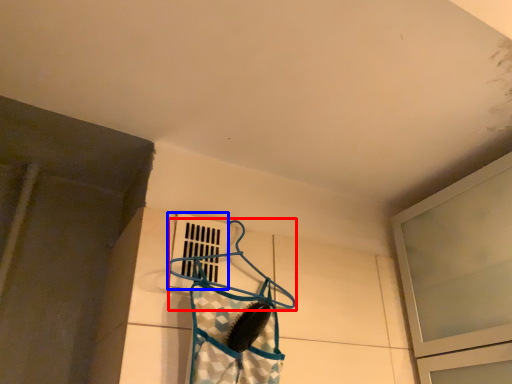
Question: Among these objects, which one is farthest to the camera, hanger (highlighted by a red box) or window (highlighted by a blue box)?

Choices:
 (A) hanger
 (B) window

Answer: (B)